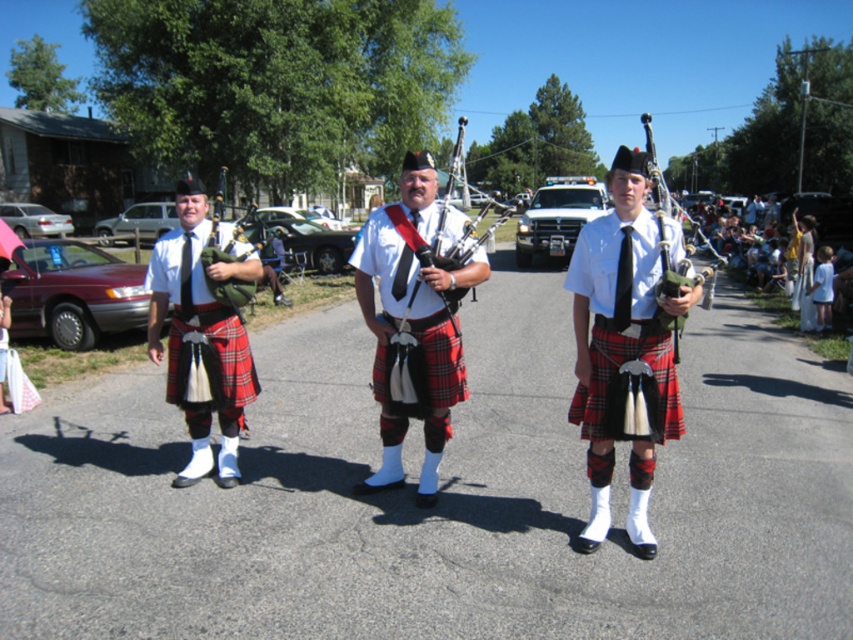
Identify the location of matte black kilt at left. The width and height of the screenshot is (853, 640). (200, 337).

Can you confirm if matte black kilt at left is thinner than matte green bagpipes at center?

Yes, matte black kilt at left is thinner than matte green bagpipes at center.

Locate an element on the screen. This screenshot has width=853, height=640. matte black kilt at left is located at coordinates [200, 337].

Is red plaid kilt at center positioned in front of matte black kilt at left?

Yes.

How much distance is there between red plaid kilt at center and matte black kilt at left?

11.27 feet

You are a GUI agent. You are given a task and a screenshot of the screen. Output one action in this format:
    pyautogui.click(x=<x>, y=<y>)
    Task: Click on the red plaid kilt at center
    The image size is (853, 640).
    Given the screenshot: What is the action you would take?
    pyautogui.click(x=625, y=344)

Which of these two, matte black kilt at center or matte black bagpipes at center, stands taller?

matte black bagpipes at center

Who is shorter, matte black kilt at center or matte black bagpipes at center?

matte black kilt at center is shorter.

At what (x,y) coordinates should I click in order to perform the action: click on matte black kilt at center. Please return your answer as a coordinate pair (x, y). Looking at the image, I should click on (415, 320).